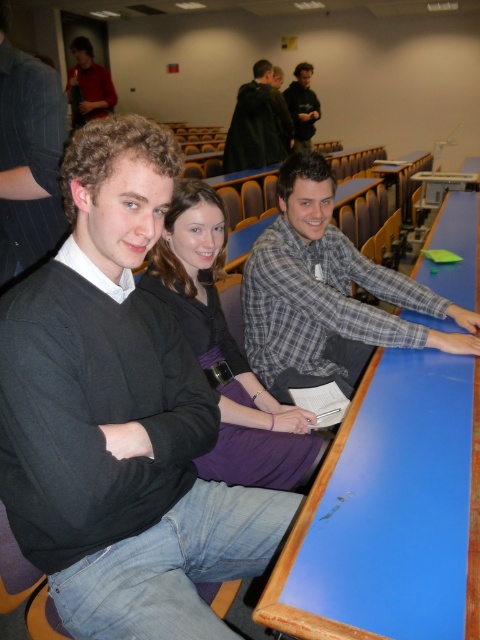
Question: Does purple fabric dress at center lie in front of dark gray sweater at upper center?

Choices:
 (A) yes
 (B) no

Answer: (A)

Question: Which point is closer to the camera taking this photo?

Choices:
 (A) (337, 296)
 (B) (242, 168)
 (C) (436, 429)

Answer: (C)

Question: Which object appears closest to the camera in this image?

Choices:
 (A) plaid shirt at center
 (B) dark gray sweater at upper center

Answer: (A)

Question: Which of the following is the farthest from the observer?

Choices:
 (A) dark brown leather jacket at upper center
 (B) dark gray sweater at upper center

Answer: (B)

Question: Does dark brown leather jacket at upper center have a lesser width compared to matte black sweater at upper left?

Choices:
 (A) yes
 (B) no

Answer: (A)

Question: Can you confirm if blue glossy table at center is positioned below plaid shirt at center?

Choices:
 (A) yes
 (B) no

Answer: (A)